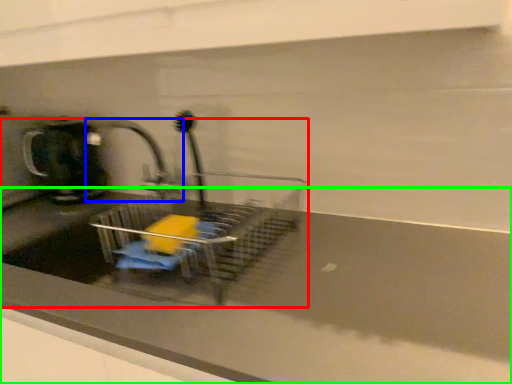
Question: Which object is positioned closest to sink (highlighted by a red box)? Select from tap (highlighted by a blue box) and counter top (highlighted by a green box).

Choices:
 (A) tap
 (B) counter top

Answer: (B)